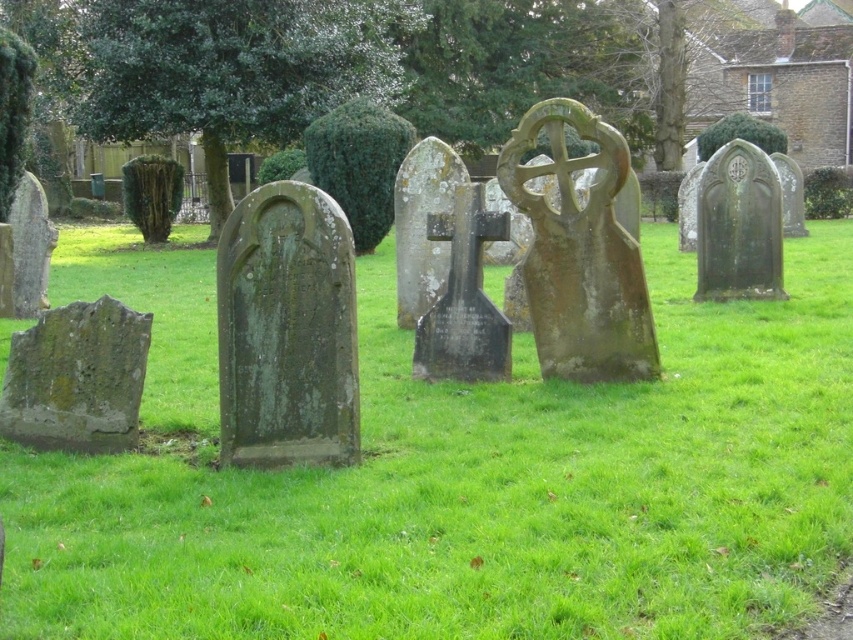
Is green mossy gravestone at center shorter than green mossy stone at lower left?

No.

Is point (317, 269) closer to viewer compared to point (117, 346)?

Yes, point (317, 269) is closer to viewer.

At what (x,y) coordinates should I click in order to perform the action: click on green mossy gravestone at center. Please return your answer as a coordinate pair (x, y). This screenshot has width=853, height=640. Looking at the image, I should click on (287, 330).

Which is behind, point (135, 374) or point (722, 205)?

The point (722, 205) is more distant.

In the scene shown: Can you confirm if green mossy stone at lower left is bigger than green stone gravestone at right?

Actually, green mossy stone at lower left might be smaller than green stone gravestone at right.

Where is `green mossy stone at lower left`? green mossy stone at lower left is located at coordinates point(76,378).

This screenshot has width=853, height=640. Find the location of `green mossy stone at lower left`. green mossy stone at lower left is located at coordinates (76, 378).

In the scene shown: Is green mossy grass at center positioned behind green stone gravestone at right?

No, green mossy grass at center is in front of green stone gravestone at right.

Does green mossy grass at center have a lesser height compared to green stone gravestone at right?

Yes.

You are a GUI agent. You are given a task and a screenshot of the screen. Output one action in this format:
    pyautogui.click(x=<x>, y=<y>)
    Task: Click on the green mossy grass at center
    
    Given the screenshot: What is the action you would take?
    pyautogui.click(x=457, y=477)

This screenshot has height=640, width=853. In order to click on green mossy grass at center in this screenshot , I will do `click(457, 477)`.